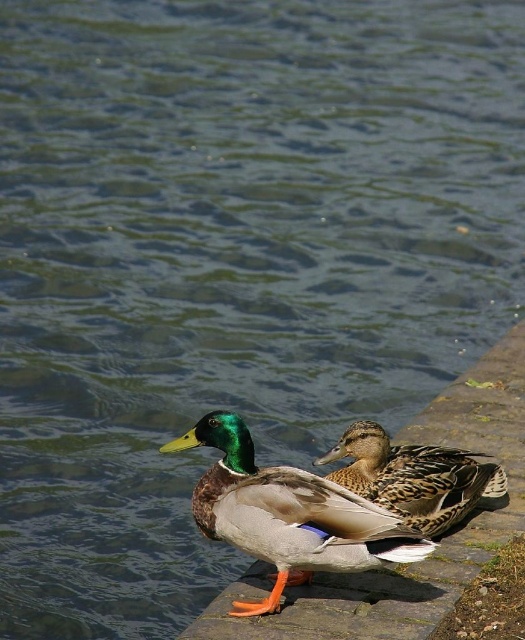
Does shiny green head at center appear on the left side of brown speckled feathers at center?

Indeed, shiny green head at center is positioned on the left side of brown speckled feathers at center.

Is shiny green head at center smaller than brown speckled feathers at center?

Correct, shiny green head at center occupies less space than brown speckled feathers at center.

Which is in front, point (250, 493) or point (470, 476)?

Point (250, 493) is more forward.

Locate an element on the screen. Image resolution: width=525 pixels, height=640 pixels. shiny green head at center is located at coordinates coord(288,513).